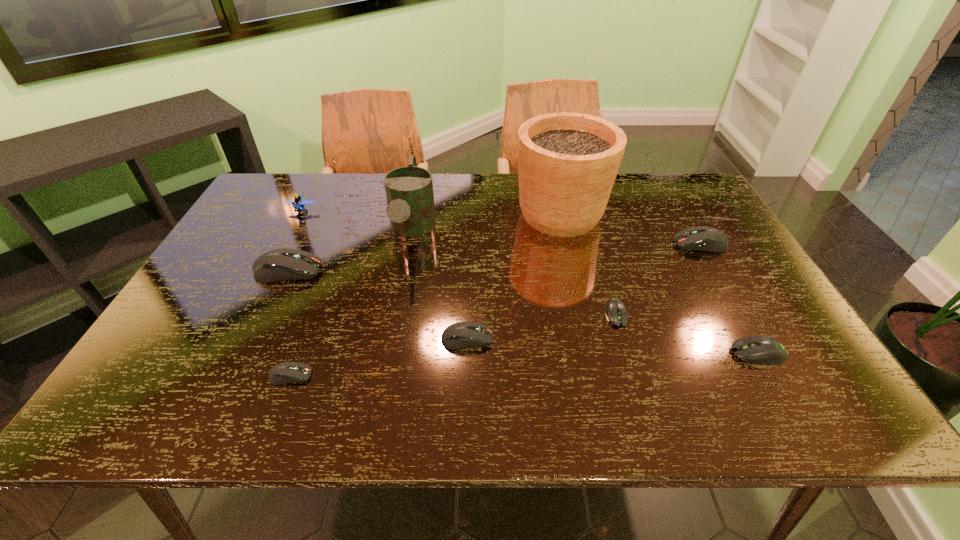
The image size is (960, 540). What are the coordinates of `the tallest object` in the screenshot? It's located at (567, 162).

Locate an element on the screen. Image resolution: width=960 pixels, height=540 pixels. the eighth shortest object is located at coordinates click(x=409, y=190).

You are a GUI agent. You are given a task and a screenshot of the screen. Output one action in this format:
    pyautogui.click(x=<x>, y=<y>)
    Task: Click on the sixth object from right to left
    
    Given the screenshot: What is the action you would take?
    pyautogui.click(x=409, y=190)

The width and height of the screenshot is (960, 540). I want to click on the tallest computer mouse, so click(282, 264).

Find the location of a particular element. Image resolution: width=960 pixels, height=540 pixels. the biggest dark computer equipment is located at coordinates (282, 264).

Where is `Lego`? Lego is located at coordinates (297, 203).

Locate an element on the screen. the fifth shortest computer mouse is located at coordinates click(703, 238).

Locate an element on the screen. the farthest computer mouse is located at coordinates (703, 238).

Locate an element on the screen. The height and width of the screenshot is (540, 960). the fifth object from left to right is located at coordinates (460, 335).

This screenshot has height=540, width=960. Find the location of `the third biggest dark computer equipment`. the third biggest dark computer equipment is located at coordinates (460, 335).